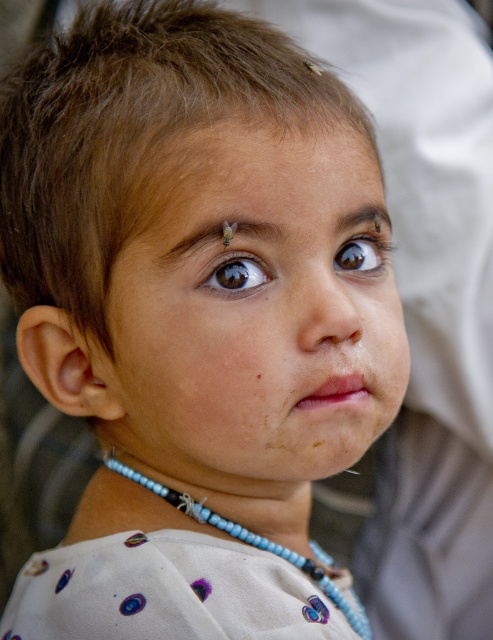
Between blue beaded necklace at lower center and brown glossy eye at center, which one has more height?

With more height is blue beaded necklace at lower center.

This screenshot has width=493, height=640. What do you see at coordinates (257, 545) in the screenshot?
I see `blue beaded necklace at lower center` at bounding box center [257, 545].

Identify the location of blue beaded necklace at lower center. Image resolution: width=493 pixels, height=640 pixels. (257, 545).

Locate an element on the screen. This screenshot has height=640, width=493. blue beaded necklace at lower center is located at coordinates (257, 545).

Is point (349, 260) positioned in front of point (260, 371)?

No, it is not.

Identify the location of brown glossy eye at center. The height and width of the screenshot is (640, 493). (359, 253).

Who is taller, dry skin at center or brown glossy eye at center?

Standing taller between the two is dry skin at center.

Can you confirm if dry skin at center is positioned above brown glossy eye at center?

Correct, dry skin at center is located above brown glossy eye at center.

Is point (368, 166) farther from viewer compared to point (375, 266)?

That is False.

In order to click on dry skin at center in this screenshot , I will do `click(271, 168)`.